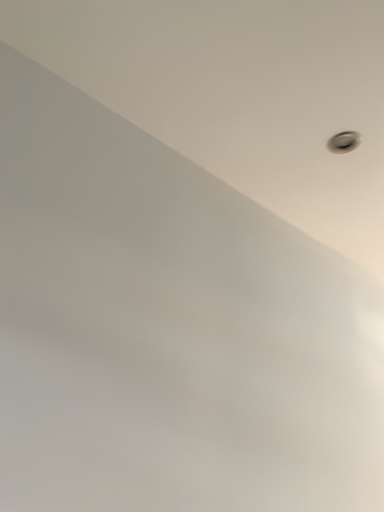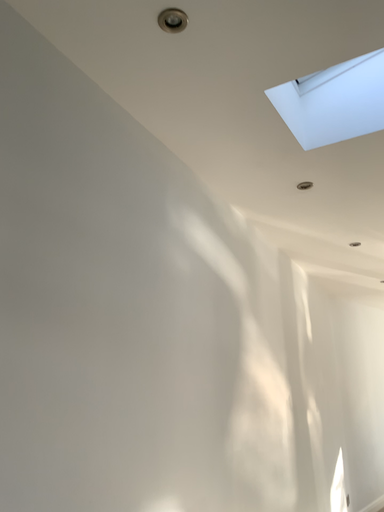
Question: Which way did the camera rotate in the video?

Choices:
 (A) rotated upward
 (B) rotated downward

Answer: (B)